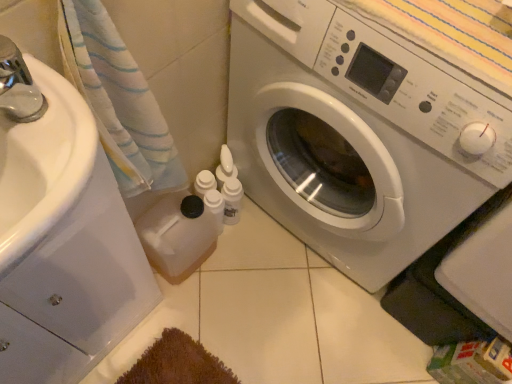
Question: Is white fabric towel at left aimed at white glossy washing machine at center?

Choices:
 (A) no
 (B) yes

Answer: (A)

Question: Does white fabric towel at left have a lesser height compared to white glossy washing machine at center?

Choices:
 (A) no
 (B) yes

Answer: (B)

Question: Considering the relative sizes of white fabric towel at left and white glossy washing machine at center in the image provided, is white fabric towel at left wider than white glossy washing machine at center?

Choices:
 (A) no
 (B) yes

Answer: (A)

Question: Considering the relative positions of white fabric towel at left and white glossy washing machine at center in the image provided, is white fabric towel at left to the right of white glossy washing machine at center from the viewer's perspective?

Choices:
 (A) yes
 (B) no

Answer: (B)

Question: Is white fabric towel at left bigger than white glossy washing machine at center?

Choices:
 (A) yes
 (B) no

Answer: (B)

Question: From the image's perspective, is white fabric towel at left positioned above or below white glossy washing machine at center?

Choices:
 (A) below
 (B) above

Answer: (A)

Question: Is point (108, 92) closer or farther from the camera than point (325, 185)?

Choices:
 (A) farther
 (B) closer

Answer: (B)

Question: Is white fabric towel at left situated inside white glossy washing machine at center or outside?

Choices:
 (A) inside
 (B) outside

Answer: (B)

Question: In terms of height, does white fabric towel at left look taller or shorter compared to white glossy washing machine at center?

Choices:
 (A) short
 (B) tall

Answer: (A)

Question: Which is correct: white plastic bottles at center, the 2th toiletry when ordered from right to left, is inside white fabric towel at left, or outside of it?

Choices:
 (A) inside
 (B) outside

Answer: (B)

Question: Considering the positions of white plastic bottles at center, marked as the 1th toiletry in a left-to-right arrangement, and white fabric towel at left in the image, is white plastic bottles at center, marked as the 1th toiletry in a left-to-right arrangement, wider or thinner than white fabric towel at left?

Choices:
 (A) wide
 (B) thin

Answer: (B)

Question: Does point (212, 200) appear closer or farther from the camera than point (150, 114)?

Choices:
 (A) farther
 (B) closer

Answer: (A)

Question: Considering their positions, is white plastic bottles at center, marked as the 1th toiletry in a left-to-right arrangement, located in front of or behind white fabric towel at left?

Choices:
 (A) behind
 (B) front

Answer: (A)

Question: From a real-world perspective, is white glossy drawer at left above or below white glossy washing machine at center?

Choices:
 (A) below
 (B) above

Answer: (A)

Question: In terms of width, does white glossy drawer at left look wider or thinner when compared to white glossy washing machine at center?

Choices:
 (A) thin
 (B) wide

Answer: (A)